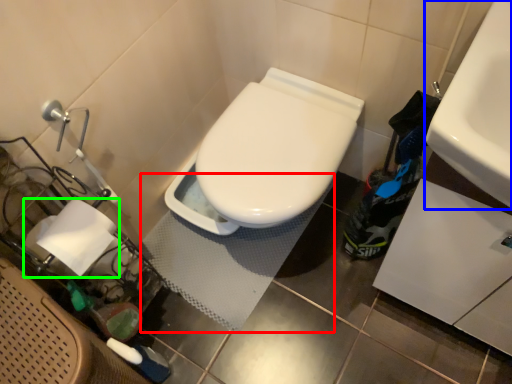
Question: Which object is the closest to the bath mat (highlighted by a red box)? Choose among these: sink (highlighted by a blue box) or toilet paper (highlighted by a green box).

Choices:
 (A) sink
 (B) toilet paper

Answer: (B)